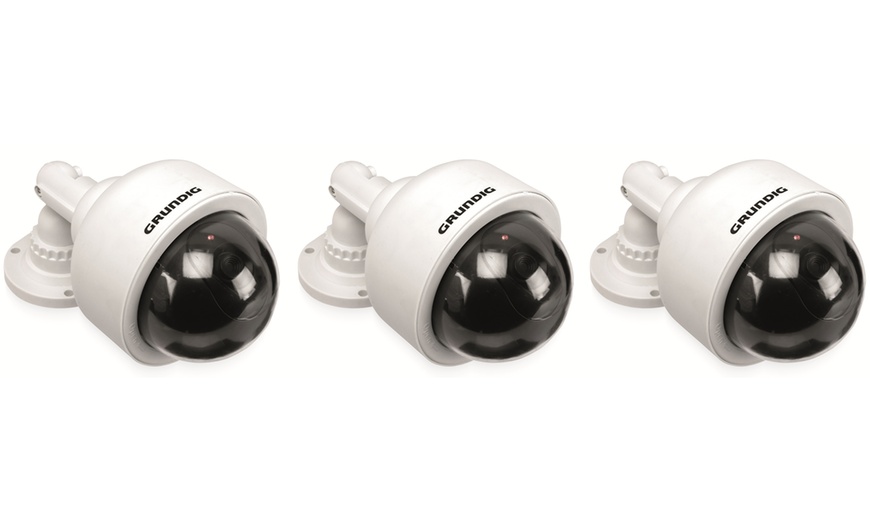
I want to click on screw hole, so click(654, 294), click(597, 250), click(619, 189), click(331, 189), click(311, 251), click(365, 294), click(67, 291), click(16, 246), click(37, 194).